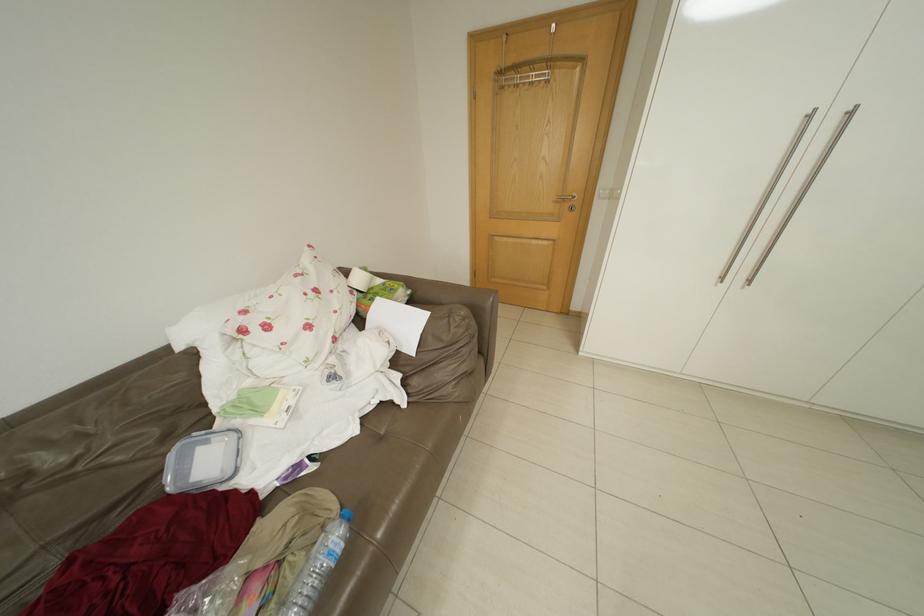
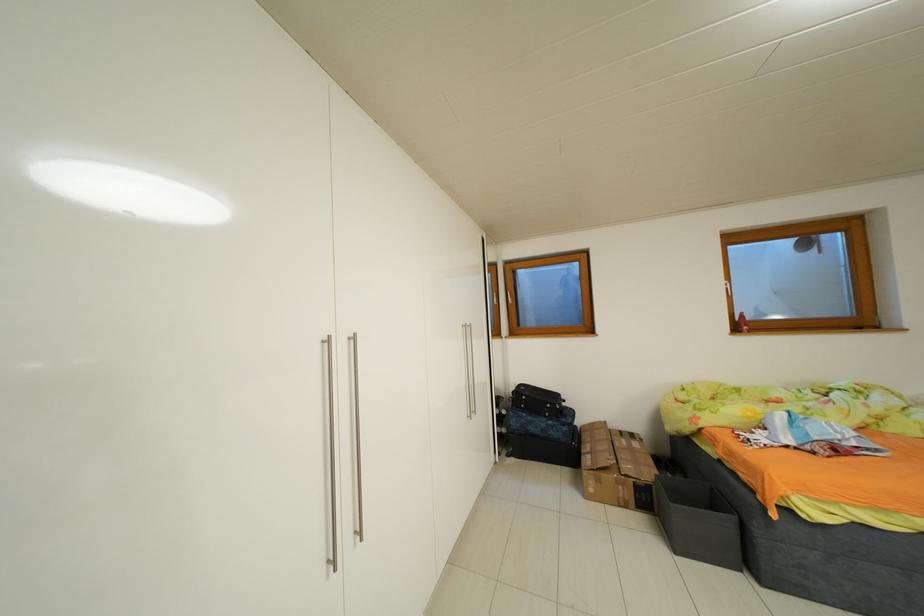
Question: The images are taken continuously from a first-person perspective. In which direction is your viewpoint rotating?

Choices:
 (A) Left
 (B) Right
 (C) Up
 (D) Down

Answer: (B)